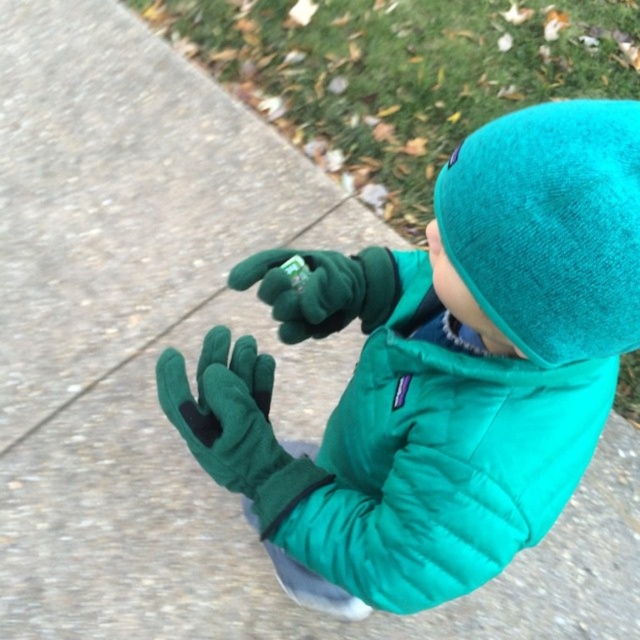
The child is holding an object in their hand. Based on the scene description, which object is wider, the teal fleece hat at upper right or the green fleece glove at center?

The teal fleece hat at upper right is wider than the green fleece glove at center according to the description.

You are a photographer trying to capture the teal fleece hat at upper right in the scene. Based on its position, where should you aim your camera relative to the child?

The teal fleece hat at upper right is located at point (548, 227), so you should aim your camera slightly to the upper right of the child to capture it.